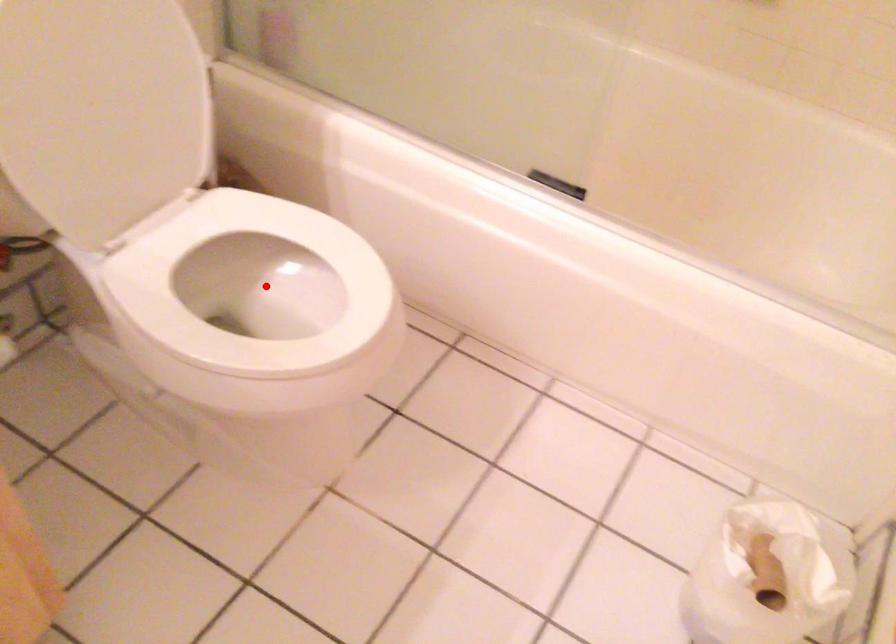
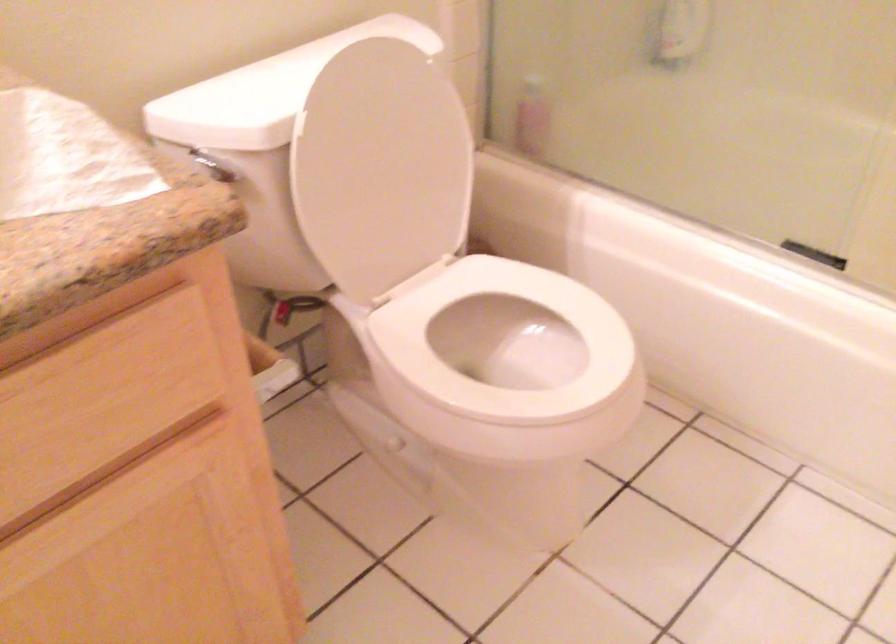
The point at the highlighted location is marked in the first image. Where is the corresponding point in the second image?

(504, 348)